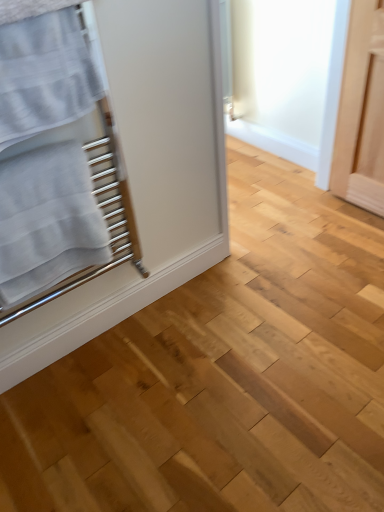
The height and width of the screenshot is (512, 384). In order to click on white textured towel at left, the 1th bath towel in the top-to-bottom sequence in this screenshot , I will do `click(44, 75)`.

What do you see at coordinates (44, 75) in the screenshot?
I see `white textured towel at left, the 1th bath towel in the top-to-bottom sequence` at bounding box center [44, 75].

I want to click on white textured towel at left, acting as the second bath towel starting from the top, so click(47, 221).

The width and height of the screenshot is (384, 512). What do you see at coordinates (47, 221) in the screenshot? I see `white textured towel at left, acting as the second bath towel starting from the top` at bounding box center [47, 221].

Where is `white textured towel at left, the 1th bath towel in the top-to-bottom sequence`? This screenshot has width=384, height=512. white textured towel at left, the 1th bath towel in the top-to-bottom sequence is located at coordinates (44, 75).

Which is more to the right, white textured towel at left, which is the second bath towel in bottom-to-top order, or white textured towel at left, acting as the second bath towel starting from the top?

white textured towel at left, which is the second bath towel in bottom-to-top order.

Is white textured towel at left, the 1th bath towel in the top-to-bottom sequence, closer to camera compared to white textured towel at left, acting as the second bath towel starting from the top?

Yes, it is.

Is point (20, 135) closer to viewer compared to point (6, 271)?

Yes.

From the image's perspective, is white textured towel at left, which is the second bath towel in bottom-to-top order, over white textured towel at left, acting as the first bath towel starting from the bottom?

Indeed, from the image's perspective, white textured towel at left, which is the second bath towel in bottom-to-top order, is shown above white textured towel at left, acting as the first bath towel starting from the bottom.

From a real-world perspective, is white textured towel at left, the 1th bath towel in the top-to-bottom sequence, physically below white textured towel at left, acting as the first bath towel starting from the bottom?

No, from a real-world perspective, white textured towel at left, the 1th bath towel in the top-to-bottom sequence, is not beneath white textured towel at left, acting as the first bath towel starting from the bottom.

Can you confirm if white textured towel at left, the 1th bath towel in the top-to-bottom sequence, is thinner than white textured towel at left, acting as the second bath towel starting from the top?

Yes, white textured towel at left, the 1th bath towel in the top-to-bottom sequence, is thinner than white textured towel at left, acting as the second bath towel starting from the top.

Is white textured towel at left, which is the second bath towel in bottom-to-top order, taller than white textured towel at left, acting as the second bath towel starting from the top?

No.

Which of these two, white textured towel at left, which is the second bath towel in bottom-to-top order, or white textured towel at left, acting as the first bath towel starting from the bottom, is bigger?

With larger size is white textured towel at left, acting as the first bath towel starting from the bottom.

Which is correct: white textured towel at left, the 1th bath towel in the top-to-bottom sequence, is inside white textured towel at left, acting as the first bath towel starting from the bottom, or outside of it?

white textured towel at left, the 1th bath towel in the top-to-bottom sequence, cannot be found inside white textured towel at left, acting as the first bath towel starting from the bottom.

Are white textured towel at left, which is the second bath towel in bottom-to-top order, and white textured towel at left, acting as the first bath towel starting from the bottom, located far from each other?

No.

Is white textured towel at left, which is the second bath towel in bottom-to-top order, oriented away from white textured towel at left, acting as the first bath towel starting from the bottom?

No, white textured towel at left, which is the second bath towel in bottom-to-top order, is not facing away from white textured towel at left, acting as the first bath towel starting from the bottom.

From the picture: How many degrees apart are the facing directions of white textured towel at left, the 1th bath towel in the top-to-bottom sequence, and white textured towel at left, acting as the first bath towel starting from the bottom?

white textured towel at left, the 1th bath towel in the top-to-bottom sequence, and white textured towel at left, acting as the first bath towel starting from the bottom, are facing 0.00139 degrees away from each other.

Measure the distance between white textured towel at left, the 1th bath towel in the top-to-bottom sequence, and white textured towel at left, acting as the second bath towel starting from the top.

white textured towel at left, the 1th bath towel in the top-to-bottom sequence, and white textured towel at left, acting as the second bath towel starting from the top, are 9.42 inches apart from each other.

Find the location of a particular element. The width and height of the screenshot is (384, 512). bath towel in front of the white textured towel at left, acting as the first bath towel starting from the bottom is located at coordinates (44, 75).

Between white textured towel at left, acting as the first bath towel starting from the bottom, and white textured towel at left, which is the second bath towel in bottom-to-top order, which one appears on the left side from the viewer's perspective?

From the viewer's perspective, white textured towel at left, acting as the first bath towel starting from the bottom, appears more on the left side.

Between white textured towel at left, acting as the second bath towel starting from the top, and white textured towel at left, which is the second bath towel in bottom-to-top order, which one is positioned in front?

white textured towel at left, which is the second bath towel in bottom-to-top order, is more forward.

Between point (10, 181) and point (22, 106), which one is positioned in front?

The point (22, 106) is more forward.

From the image's perspective, between white textured towel at left, acting as the first bath towel starting from the bottom, and white textured towel at left, the 1th bath towel in the top-to-bottom sequence, which one is located above?

white textured towel at left, the 1th bath towel in the top-to-bottom sequence, appears higher in the image.

From a real-world perspective, is white textured towel at left, acting as the second bath towel starting from the top, positioned under white textured towel at left, the 1th bath towel in the top-to-bottom sequence, based on gravity?

Yes, from a real-world perspective, white textured towel at left, acting as the second bath towel starting from the top, is beneath white textured towel at left, the 1th bath towel in the top-to-bottom sequence.

Does white textured towel at left, acting as the first bath towel starting from the bottom, have a lesser width compared to white textured towel at left, which is the second bath towel in bottom-to-top order?

In fact, white textured towel at left, acting as the first bath towel starting from the bottom, might be wider than white textured towel at left, which is the second bath towel in bottom-to-top order.

Does white textured towel at left, acting as the first bath towel starting from the bottom, have a greater height compared to white textured towel at left, which is the second bath towel in bottom-to-top order?

Yes.

Considering the sizes of objects white textured towel at left, acting as the second bath towel starting from the top, and white textured towel at left, which is the second bath towel in bottom-to-top order, in the image provided, who is bigger, white textured towel at left, acting as the second bath towel starting from the top, or white textured towel at left, which is the second bath towel in bottom-to-top order,?

Bigger between the two is white textured towel at left, acting as the second bath towel starting from the top.

Is white textured towel at left, acting as the second bath towel starting from the top, inside the boundaries of white textured towel at left, the 1th bath towel in the top-to-bottom sequence, or outside?

white textured towel at left, acting as the second bath towel starting from the top, is not enclosed by white textured towel at left, the 1th bath towel in the top-to-bottom sequence.

Is white textured towel at left, acting as the second bath towel starting from the top, directly adjacent to white textured towel at left, which is the second bath towel in bottom-to-top order?

No.

From the picture: Is white textured towel at left, the 1th bath towel in the top-to-bottom sequence, at the back of white textured towel at left, acting as the second bath towel starting from the top?

white textured towel at left, acting as the second bath towel starting from the top, does not have its back to white textured towel at left, the 1th bath towel in the top-to-bottom sequence.

Measure the distance from white textured towel at left, acting as the second bath towel starting from the top, to white textured towel at left, the 1th bath towel in the top-to-bottom sequence.

9.42 inches.

Image resolution: width=384 pixels, height=512 pixels. I want to click on bath towel on the left side of white textured towel at left, which is the second bath towel in bottom-to-top order, so click(47, 221).

Where is `bath towel that is in front of the white textured towel at left, acting as the first bath towel starting from the bottom`? bath towel that is in front of the white textured towel at left, acting as the first bath towel starting from the bottom is located at coordinates (44, 75).

Where is `bath towel directly beneath the white textured towel at left, the 1th bath towel in the top-to-bottom sequence (from a real-world perspective)`? This screenshot has width=384, height=512. bath towel directly beneath the white textured towel at left, the 1th bath towel in the top-to-bottom sequence (from a real-world perspective) is located at coordinates (47, 221).